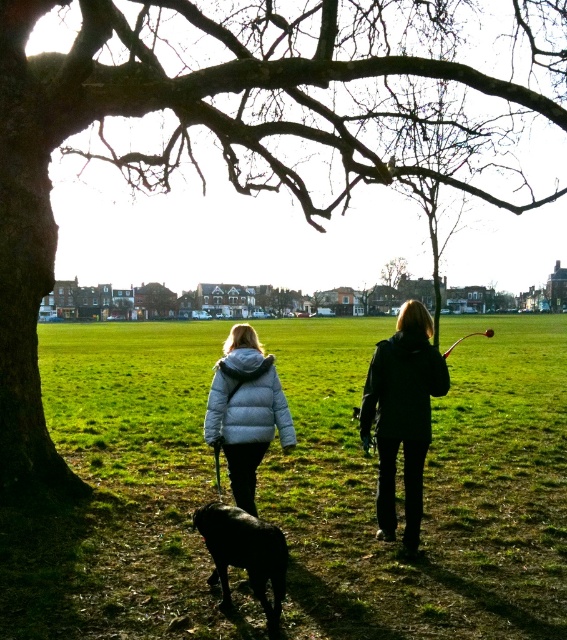
You are standing in the park and see the green grass at center and the white puffy jacket at center. Which object is closer to the ground?

The green grass at center is closer to the ground as it is located below the white puffy jacket at center.